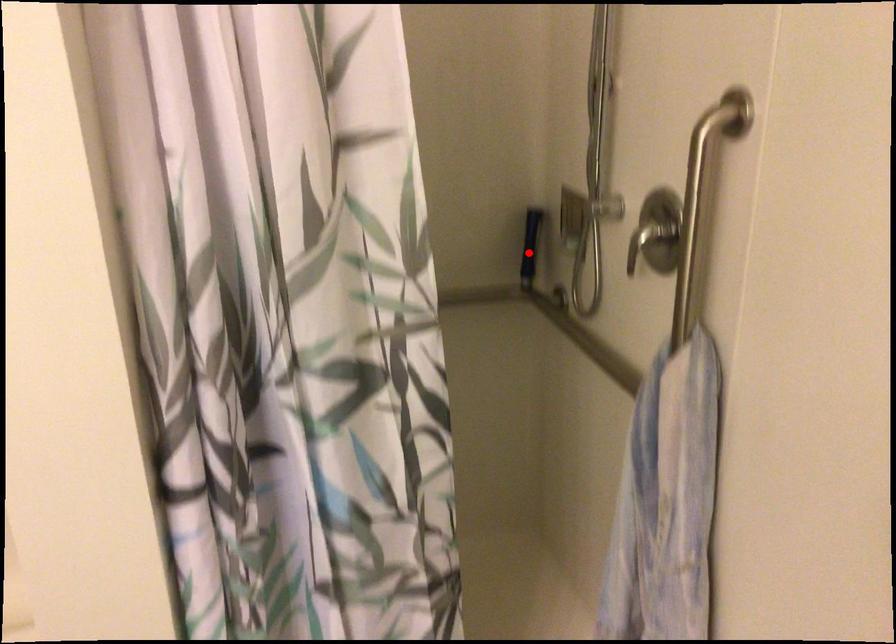
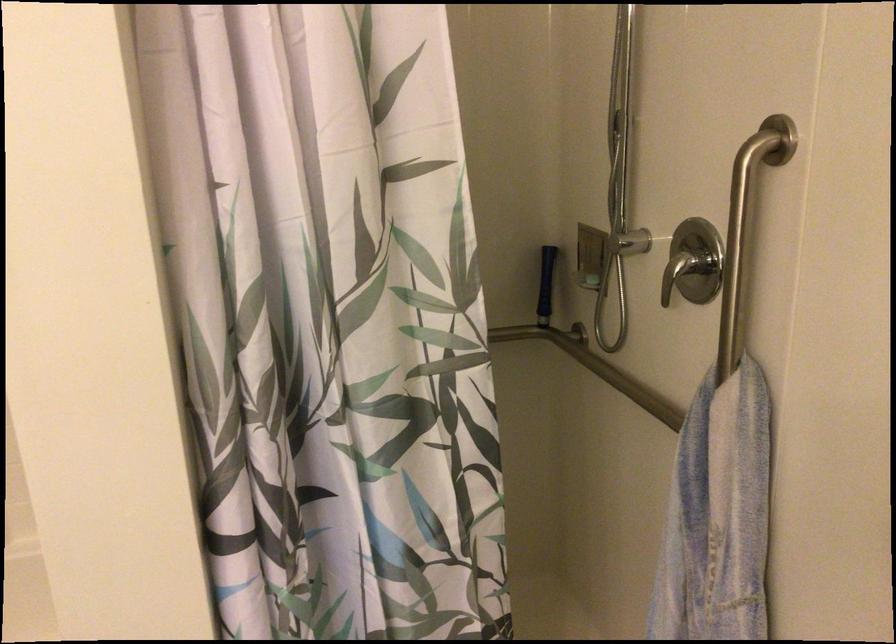
Find the pixel in the second image that matches the highlighted location in the first image.

(546, 285)